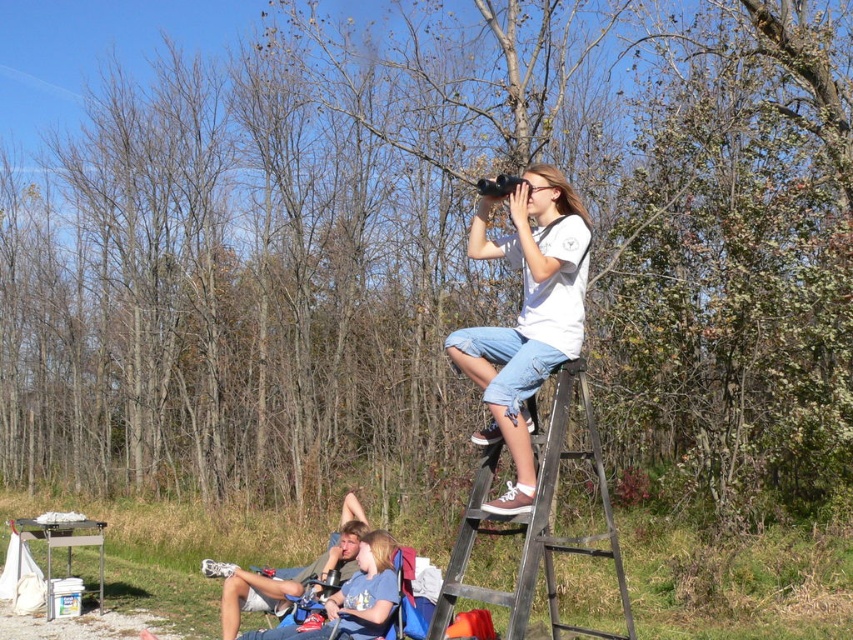
Is point (453, 568) positioned before point (343, 579)?

Yes, point (453, 568) is in front of point (343, 579).

Between metallic silver ladder at upper right and denim shorts at lower left, which one has less height?

denim shorts at lower left

Is point (608, 550) positioned before point (341, 556)?

Yes.

Find the location of a particular element. The height and width of the screenshot is (640, 853). metallic silver ladder at upper right is located at coordinates (534, 524).

Image resolution: width=853 pixels, height=640 pixels. I want to click on white cotton shirt at upper center, so click(527, 316).

Who is higher up, white cotton shirt at upper center or denim shorts at lower left?

white cotton shirt at upper center

What do you see at coordinates (527, 316) in the screenshot? I see `white cotton shirt at upper center` at bounding box center [527, 316].

Identify the location of white cotton shirt at upper center. (527, 316).

Is white cotton shirt at upper center in front of metallic silver ladder at upper right?

No.

Is white cotton shirt at upper center shorter than metallic silver ladder at upper right?

Correct, white cotton shirt at upper center is not as tall as metallic silver ladder at upper right.

Between point (544, 253) and point (454, 584), which one is positioned behind?

The point (454, 584) is more distant.

The image size is (853, 640). What are the coordinates of `white cotton shirt at upper center` in the screenshot? It's located at tap(527, 316).